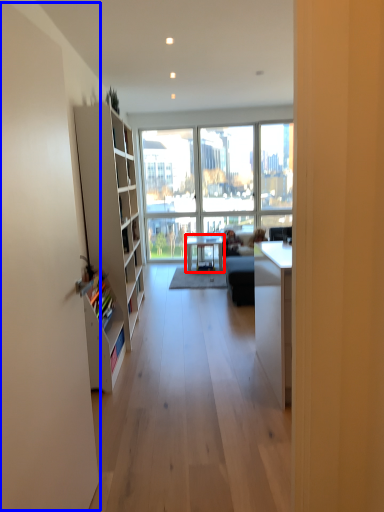
Question: Which object appears closest to the camera in this image, table (highlighted by a red box) or screen door (highlighted by a blue box)?

Choices:
 (A) table
 (B) screen door

Answer: (B)